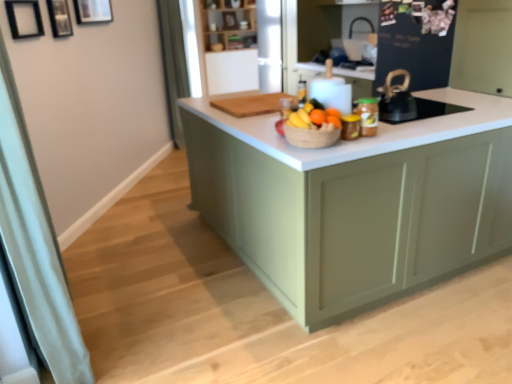
Question: Looking at the image, does wooden picture frame at upper left, which appears as the 3th picture frame when viewed from the front, seem bigger or smaller compared to green fabric curtain at left, which is counted as the second curtain, starting from the front?

Choices:
 (A) small
 (B) big

Answer: (A)

Question: In terms of height, does wooden picture frame at upper left, arranged as the first picture frame when viewed from the back, look taller or shorter compared to green fabric curtain at left, which is counted as the second curtain, starting from the front?

Choices:
 (A) short
 (B) tall

Answer: (A)

Question: Estimate the real-world distances between objects in this image. Which object is closer to the bright yellow bananas at center?

Choices:
 (A) wooden picture frame at upper left, which appears as the 3th picture frame when viewed from the front
 (B) orange matte at center
 (C) white fabric curtain at left, which appears as the first curtain when viewed from the front
 (D) wooden shelves at upper center
 (E) orange matte at center, which appears as the first orange when viewed from the right

Answer: (B)

Question: Considering the real-world distances, which object is farthest from the wooden picture frame at upper left, which appears as the 3th picture frame when viewed from the front?

Choices:
 (A) black matte kettle at upper right
 (B) wooden picture frame at upper left, which ranks as the 2th picture frame in front-to-back order
 (C) translucent glass bottle at center
 (D) matte green cabinet at center
 (E) metallic silver jar at center

Answer: (D)